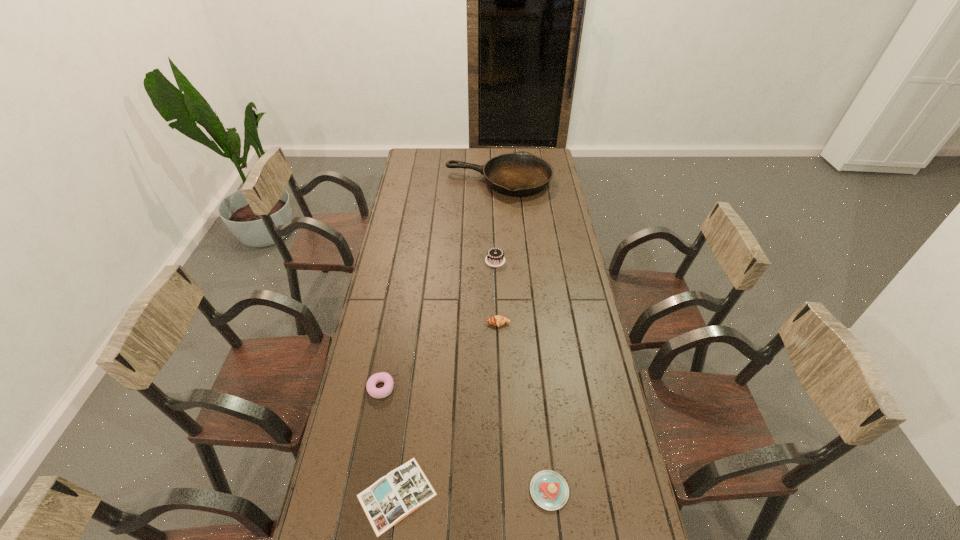
Image resolution: width=960 pixels, height=540 pixels. I want to click on blank space located on the front-facing side of the third farthest object, so click(x=501, y=396).

The height and width of the screenshot is (540, 960). In order to click on vacant area located on the right of the leftmost pastry in this screenshot , I will do `click(486, 388)`.

Where is `free space located on the back of the nearest pastry`? Image resolution: width=960 pixels, height=540 pixels. free space located on the back of the nearest pastry is located at coordinates (542, 425).

This screenshot has width=960, height=540. What are the coordinates of `free spot located 0.060m on the right of the shortest object` in the screenshot? It's located at (459, 495).

Find the location of a particular element. This screenshot has width=960, height=540. object positioned at the far edge is located at coordinates (519, 174).

The height and width of the screenshot is (540, 960). Find the location of `pastry present at the left edge`. pastry present at the left edge is located at coordinates (386, 390).

In order to click on book that is at the left edge in this screenshot , I will do [x=390, y=499].

You are a GUI agent. You are given a task and a screenshot of the screen. Output one action in this format:
    pyautogui.click(x=<x>, y=<y>)
    Task: Click on the object that is at the right edge
    
    Given the screenshot: What is the action you would take?
    pyautogui.click(x=519, y=174)

What are the coordinates of `object at the far right corner` in the screenshot? It's located at (519, 174).

Where is `vacant region at the far edge of the desktop`? vacant region at the far edge of the desktop is located at coordinates (436, 163).